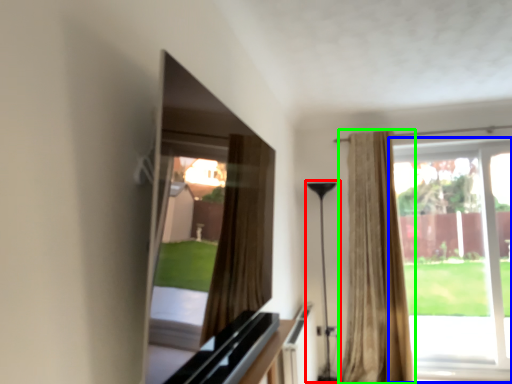
Question: Which is farther away from lamp (highlighted by a red box)? window (highlighted by a blue box) or curtain (highlighted by a green box)?

Choices:
 (A) window
 (B) curtain

Answer: (A)